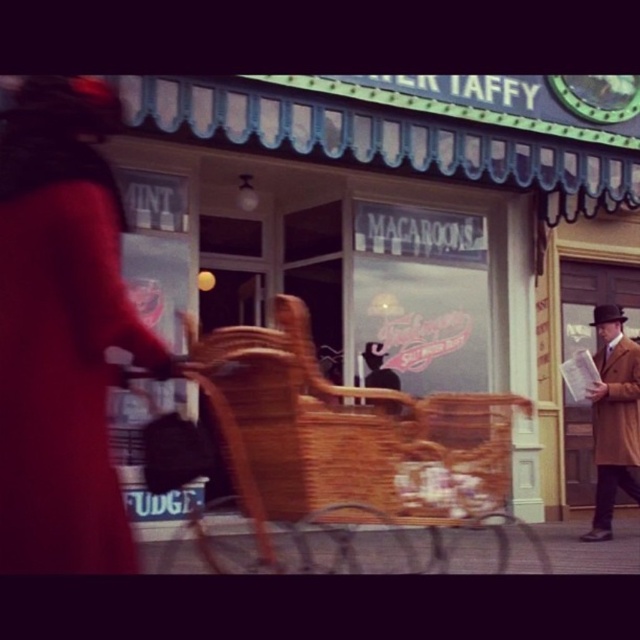
Who is more distant from viewer, (81,572) or (605,372)?

The point (605,372) is behind.

Is velvet red coat at upper left positioned at the back of tan wool coat at right?

That is False.

Find the location of a particular element. velvet red coat at upper left is located at coordinates (61, 332).

Is velvet red coat at upper left positioned at the back of brown wool coat at right?

No.

Can you confirm if velvet red coat at upper left is shorter than brown wool coat at right?

Indeed, velvet red coat at upper left has a lesser height compared to brown wool coat at right.

Where is `velvet red coat at upper left`? velvet red coat at upper left is located at coordinates (61, 332).

Is the position of velvet red coat at upper left more distant than that of woven wood baby carriage at center?

No, velvet red coat at upper left is in front of woven wood baby carriage at center.

Is velvet red coat at upper left in front of woven wood baby carriage at center?

Yes, it is in front of woven wood baby carriage at center.

Between point (60, 173) and point (428, 522), which one is positioned in front?

Positioned in front is point (60, 173).

Locate an element on the screen. This screenshot has width=640, height=640. velvet red coat at upper left is located at coordinates (61, 332).